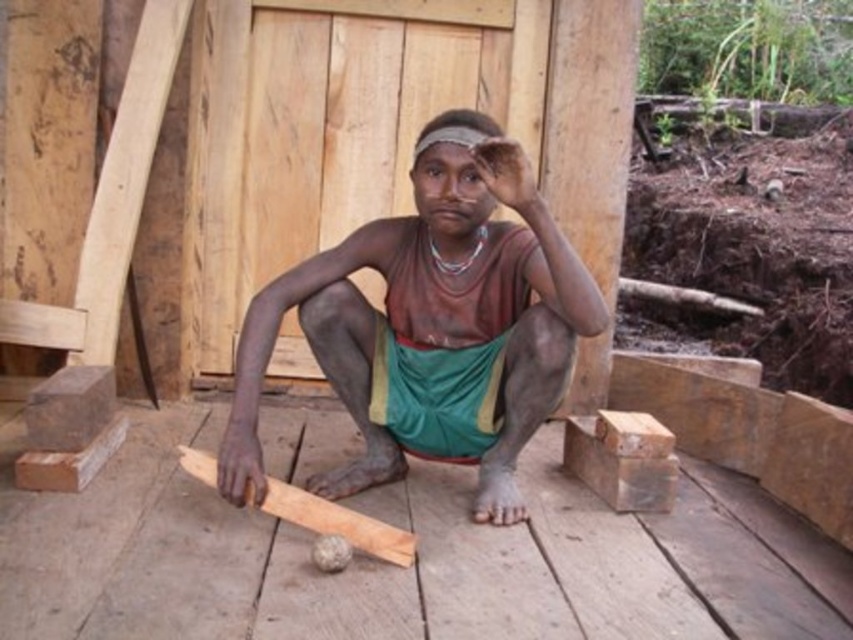
Is point (233, 440) behind point (515, 205)?

Yes, it is.

Who is positioned more to the left, brown wood plank at lower center or dry skin at center?

Positioned to the left is brown wood plank at lower center.

Between point (225, 472) and point (517, 212), which one is positioned in front?

Point (225, 472)

At what (x,y) coordinates should I click in order to perform the action: click on brown wood plank at lower center. Please return your answer as a coordinate pair (x, y). Looking at the image, I should click on (241, 461).

The width and height of the screenshot is (853, 640). Describe the element at coordinates (434, 317) in the screenshot. I see `brown matte wood at center` at that location.

Is point (372, 365) more distant than point (259, 454)?

Yes, point (372, 365) is behind point (259, 454).

Is point (393, 332) in front of point (251, 467)?

No, it is not.

You are a GUI agent. You are given a task and a screenshot of the screen. Output one action in this format:
    pyautogui.click(x=<x>, y=<y>)
    Task: Click on the brown matte wood at center
    This screenshot has width=853, height=640.
    Given the screenshot: What is the action you would take?
    pyautogui.click(x=434, y=317)

Does point (584, 289) come closer to viewer compared to point (508, 163)?

No, (584, 289) is behind (508, 163).

Does brown matte wood at center have a lesser height compared to dry skin at center?

No, brown matte wood at center is not shorter than dry skin at center.

This screenshot has height=640, width=853. Identify the location of brown matte wood at center. (434, 317).